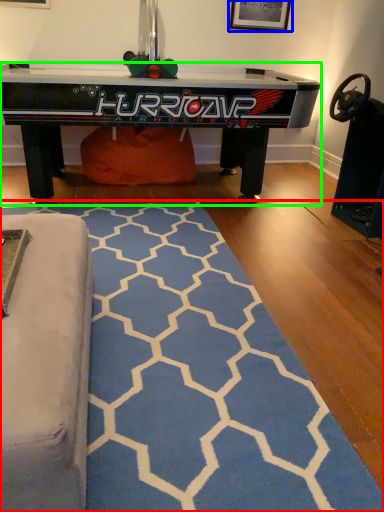
Question: Based on their relative distances, which object is farther from mat (highlighted by a red box)? Choose from picture frame (highlighted by a blue box) and table (highlighted by a green box).

Choices:
 (A) picture frame
 (B) table

Answer: (A)